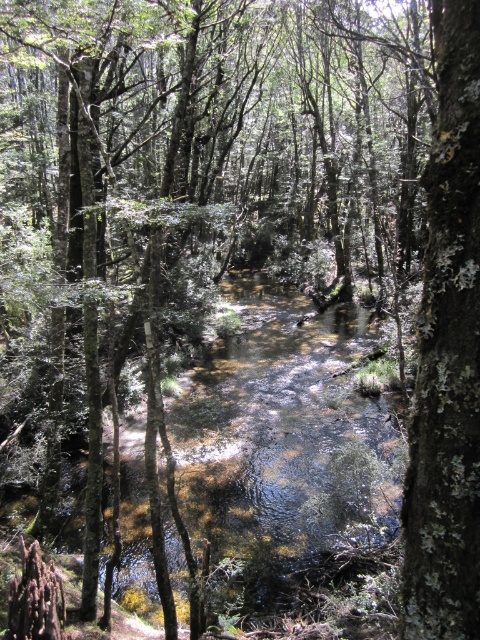
Question: In this image, where is clear water at center located relative to lichen-covered bark tree at center-right?

Choices:
 (A) below
 (B) above

Answer: (A)

Question: Does clear water at center appear under lichen-covered bark tree at center-right?

Choices:
 (A) yes
 (B) no

Answer: (A)

Question: Which point is closer to the camera taking this photo?

Choices:
 (A) (201, 456)
 (B) (444, 0)

Answer: (B)

Question: Which object appears closest to the camera in this image?

Choices:
 (A) clear water at center
 (B) lichen-covered bark tree at center-right

Answer: (B)

Question: Is clear water at center further to camera compared to lichen-covered bark tree at center-right?

Choices:
 (A) no
 (B) yes

Answer: (B)